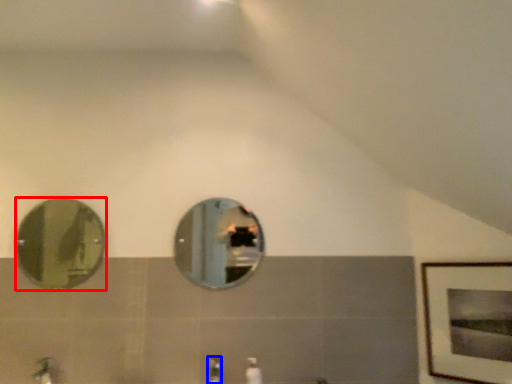
Question: Among these objects, which one is farthest to the camera, mirror (highlighted by a red box) or faucet (highlighted by a blue box)?

Choices:
 (A) mirror
 (B) faucet

Answer: (A)